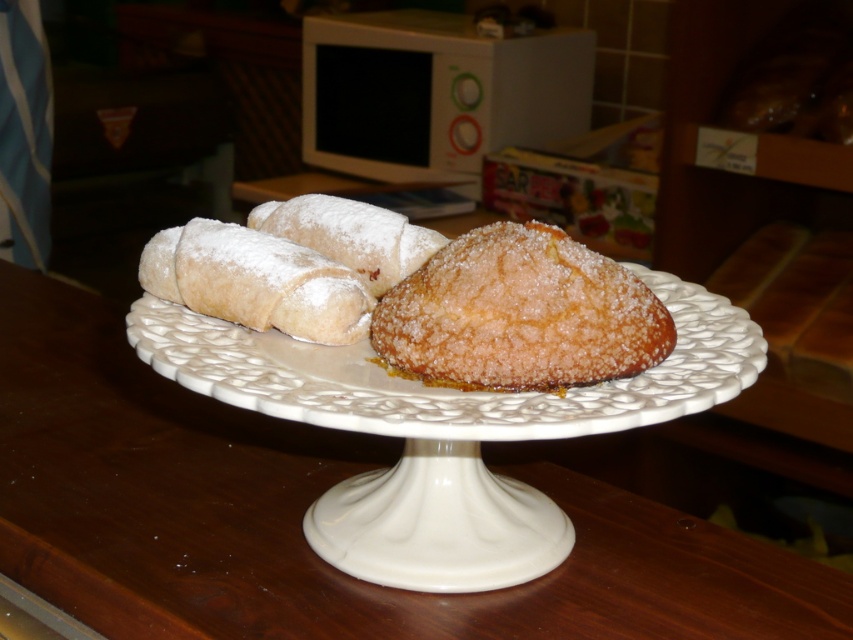
You are standing in front of a table with the white ceramic cake stand at center. If you were to place a small decoration exactly at point (303, 513), where would that be?

The point (303, 513) corresponds to the white ceramic cake stand at center, so placing the decoration there would put it directly on the cake stand.

You are a chef holding a 12 inch long spatula. You want to reach the white ceramic cake stand at center from your current position. Can you reach it with your spatula?

The white ceramic cake stand at center and camera are 19.35 inches apart from each other. Since the spatula is only 12 inches long, the chef cannot reach the white ceramic cake stand at center with the spatula.